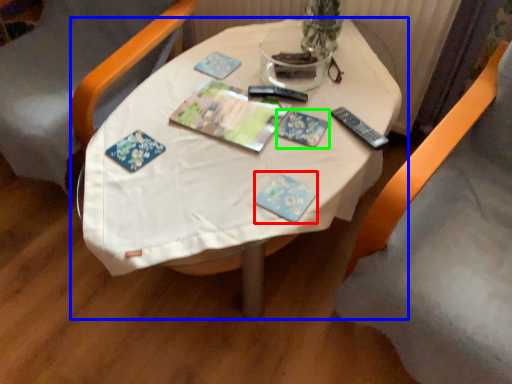
Question: Which is nearer to the paperback book (highlighted by a red box)? table (highlighted by a blue box) or paperback book (highlighted by a green box).

Choices:
 (A) table
 (B) paperback book

Answer: (B)